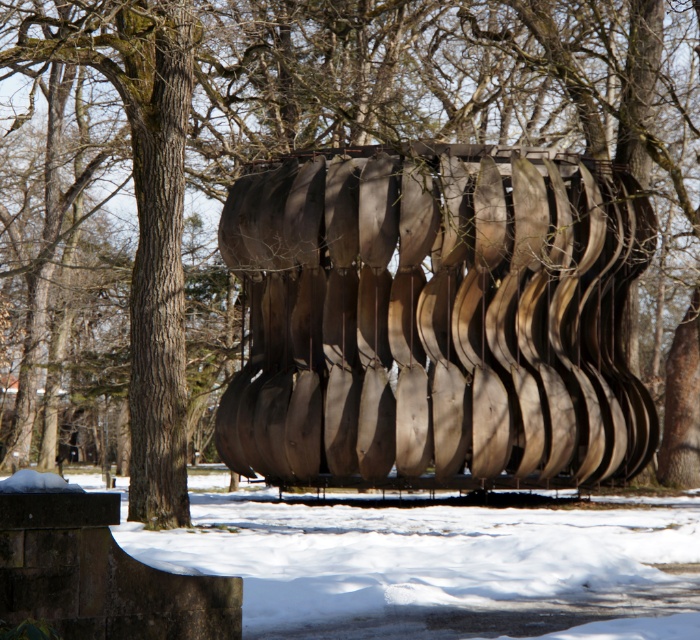
Looking at this image, is wooden sculpture at center smaller than white powdery snow at lower center?

Indeed, wooden sculpture at center has a smaller size compared to white powdery snow at lower center.

Where is `wooden sculpture at center`? The width and height of the screenshot is (700, 640). wooden sculpture at center is located at coordinates (438, 320).

Does point (288, 161) come behind point (290, 636)?

Yes.

Find the location of `wooden sculpture at center`. wooden sculpture at center is located at coordinates (438, 320).